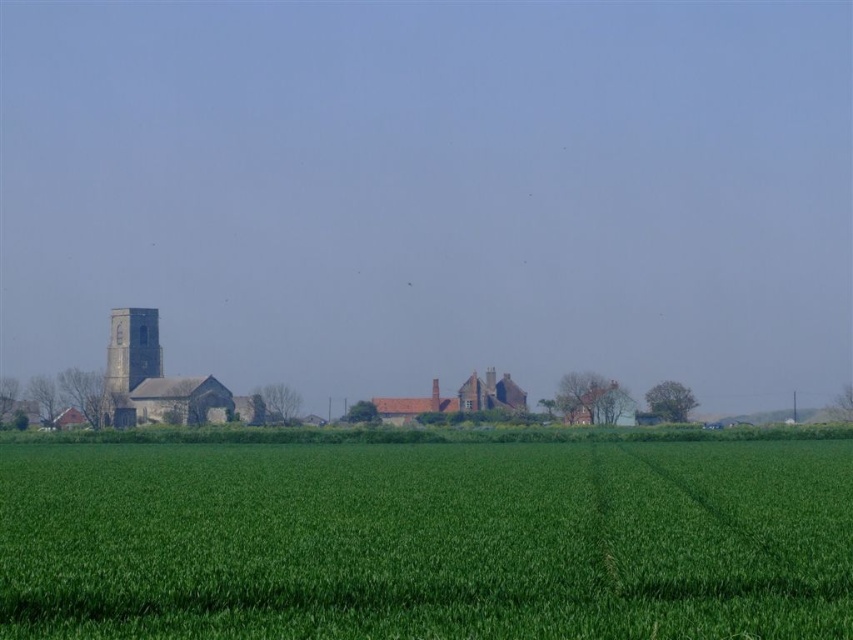
You are a farmer standing in the middle of the green grass at center. You want to reach the dark gray stone tower at left to check the weather vane on its roof. Which direction should you walk to get there?

Since the green grass at center is located below the dark gray stone tower at left, you should walk upwards or towards the left to reach the tower.

In the scene shown: You are a drone operator who needs to fly a drone from the green grass at center to the dark gray stone tower at left. Considering the height difference between them, will the drone have to ascend or descend to reach its destination?

The green grass at center is shorter than the dark gray stone tower at left, so the drone will have to ascend to reach the dark gray stone tower at left.

You are a drone operator trying to capture aerial footage of the green grass at center and the dark gray stone tower at left. Which object will appear bigger in your camera view?

The green grass at center will appear bigger in the camera view because it is larger in size than the dark gray stone tower at left.